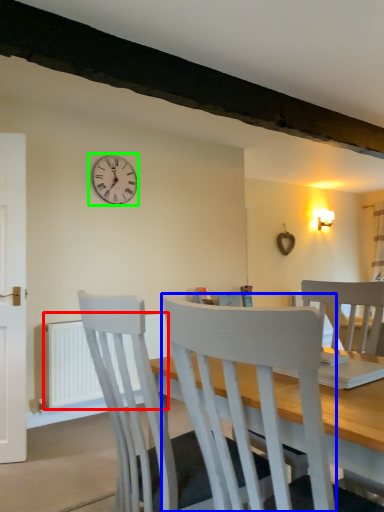
Question: Which object is positioned farthest from radiator (highlighted by a red box)? Select from chair (highlighted by a blue box) and wall clock (highlighted by a green box).

Choices:
 (A) chair
 (B) wall clock

Answer: (A)